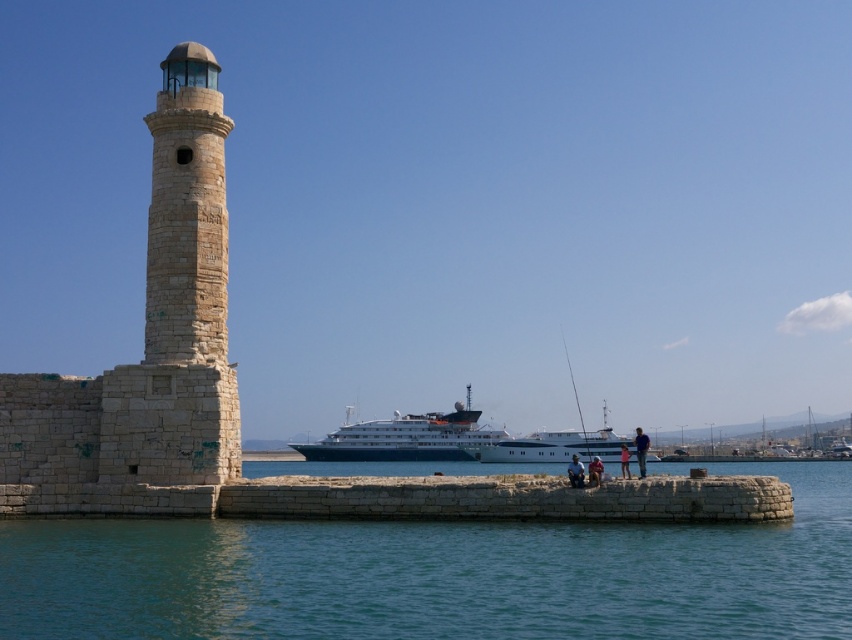
Question: Estimate the real-world distances between objects in this image. Which object is closer to the clear blue water at lower center?

Choices:
 (A) stone pier at center
 (B) white glossy yacht at center
 (C) pink fabric shorts at lower center

Answer: (A)

Question: Does white glossy cruise ship at center have a smaller size compared to light brown wooden chair at lower center?

Choices:
 (A) yes
 (B) no

Answer: (A)

Question: Is clear blue water at lower center wider than white glossy yacht at center?

Choices:
 (A) yes
 (B) no

Answer: (A)

Question: Is smooth white pole at center to the left of blue denim jeans at center from the viewer's perspective?

Choices:
 (A) yes
 (B) no

Answer: (B)

Question: Which object is positioned closest to the blue denim jeans at center?

Choices:
 (A) light brown wooden chair at lower center
 (B) white glossy cruise ship at center

Answer: (B)

Question: Which of the following is the farthest from the observer?

Choices:
 (A) white glossy yacht at center
 (B) blue denim jeans at center
 (C) light brown wooden chair at lower center

Answer: (A)